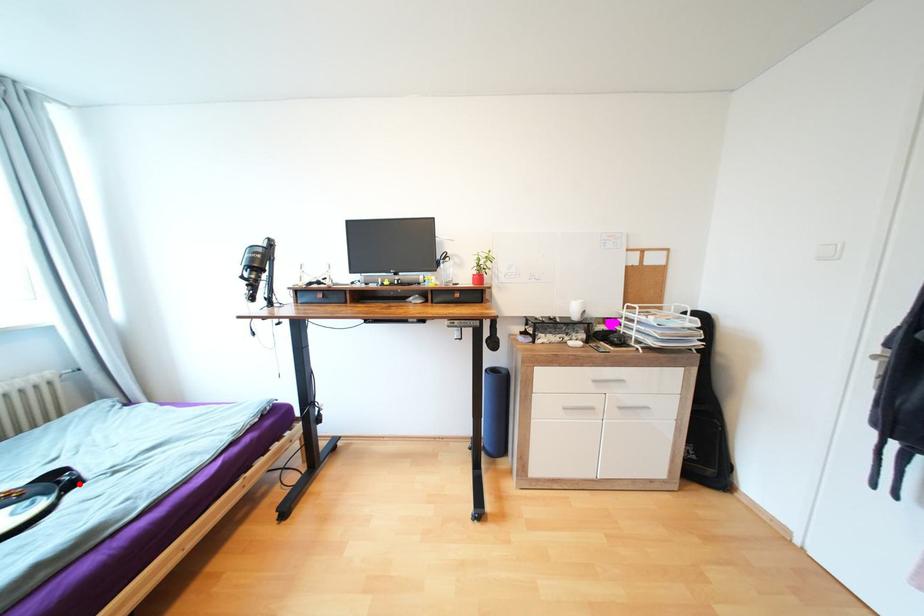
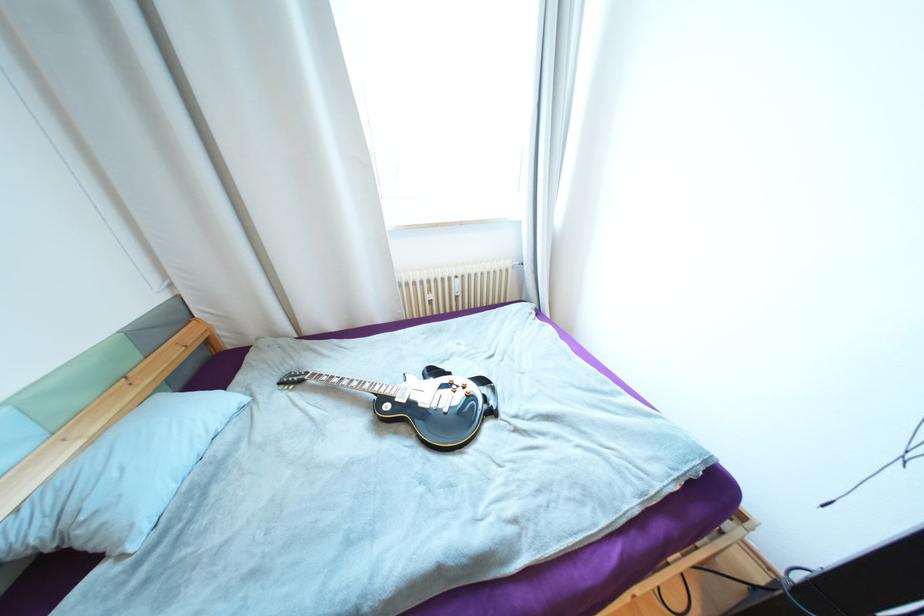
The point at the highlighted location is marked in the first image. Where is the corresponding point in the second image?

(497, 413)